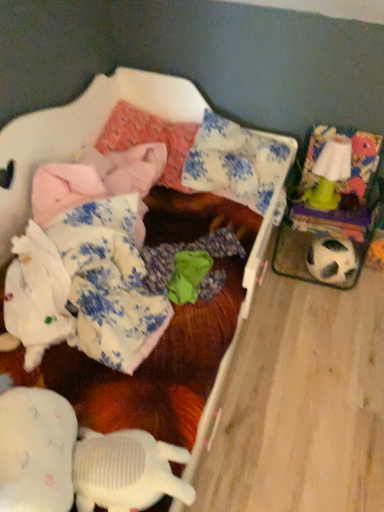
Question: Considering the positions of black and white textured football at right and pink fabric pillow at upper center, placed as the second pillow when sorted from right to left, in the image, is black and white textured football at right taller or shorter than pink fabric pillow at upper center, placed as the second pillow when sorted from right to left,?

Choices:
 (A) short
 (B) tall

Answer: (A)

Question: Is black and white textured football at right bigger or smaller than pink fabric pillow at upper center, positioned as the 1th pillow in left-to-right order?

Choices:
 (A) small
 (B) big

Answer: (A)

Question: Which object is positioned farthest from the black and white textured football at right?

Choices:
 (A) green plastic lamp at upper right
 (B) blue floral fabric pillow at center, marked as the 1th pillow in a right-to-left arrangement
 (C) pink fabric pillow at upper center, positioned as the 1th pillow in left-to-right order
 (D) white plush toy at lower left
 (E) green fabric at center, which is the 2th clothing from left to right

Answer: (D)

Question: Estimate the real-world distances between objects in this image. Which object is closer to the white fabric at lower left, the 2th clothing from the right?

Choices:
 (A) blue floral fabric pillow at center, which is the second pillow from left to right
 (B) green fabric at center, which is the 2th clothing from left to right
 (C) white plush toy at lower left
 (D) pink fabric pillow at upper center, positioned as the 1th pillow in left-to-right order
 (E) fluffy pink blanket at upper left

Answer: (B)